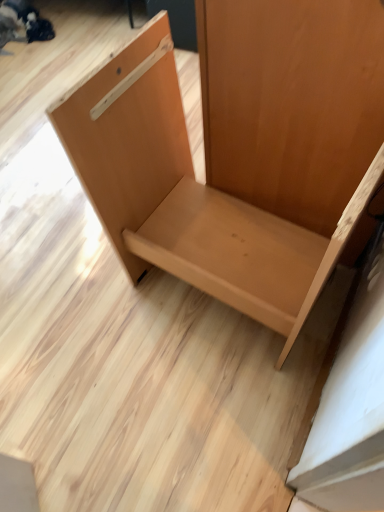
This screenshot has height=512, width=384. Find the location of `vacant space that is to the left of light brown wood chair at center`. vacant space that is to the left of light brown wood chair at center is located at coordinates (79, 315).